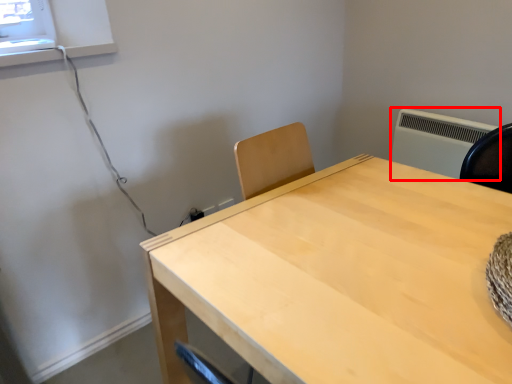
Question: Considering the relative positions of air conditioning (annotated by the red box) and table in the image provided, where is air conditioning (annotated by the red box) located with respect to the staircase?

Choices:
 (A) right
 (B) left

Answer: (A)